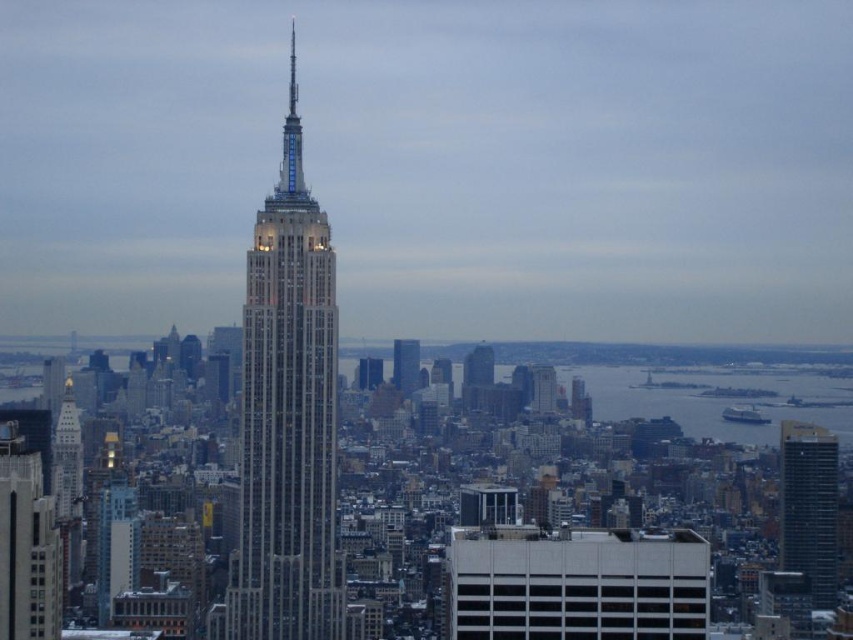
You are a tourist standing in the city and want to take a photo of both the white marble skyscraper at center and the glassy reflective skyscraper at center. Which one should you position to the left side of your camera frame to include both in the photo?

You should position the white marble skyscraper at center to the left side of your camera frame because it is already to the left of the glassy reflective skyscraper at center in the scene.

You are standing at the center of the city, and you want to reach the dark glass skyscraper at right. If your walking speed is 3 feet per second, how many seconds will it take you to reach it?

The dark glass skyscraper at right is 2189.29 feet away from the viewer. At a walking speed of 3 feet per second, it would take approximately 729.76 seconds to reach it.

You are a drone operator planning to fly a drone between the glassy steel skyscraper at center and the glassy reflective skyscraper at center. The drone has a wingspan of 50 feet. Can the drone safely navigate the gap between them?

The distance between the glassy steel skyscraper at center and the glassy reflective skyscraper at center is 53.53 feet, which is wider than the drone wingspan of 50 feet. Therefore, the drone can safely navigate the gap between them.